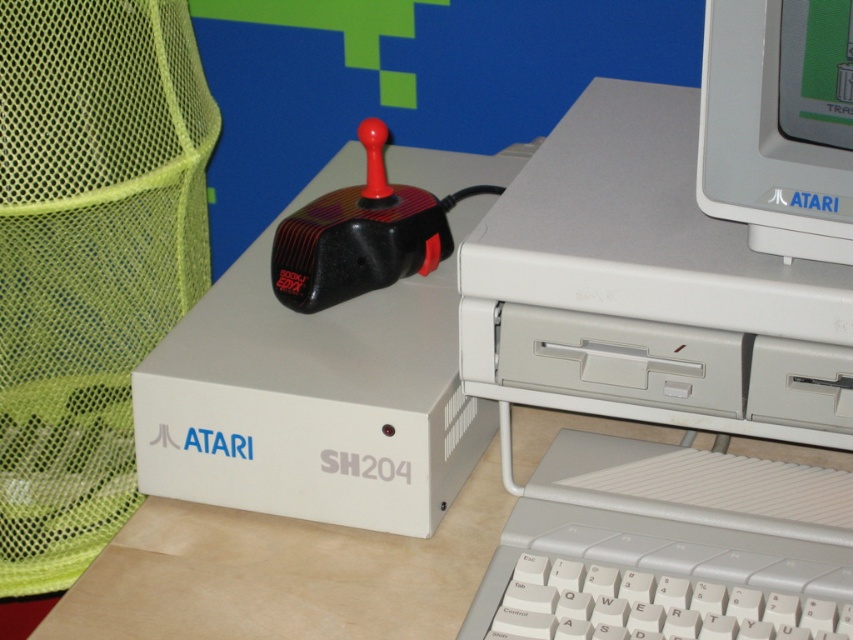
You are setting up a desk for a retro gaming setup. You have a white plastic computer at center and a matte plastic monitor at upper right. Which object should you place first to ensure proper height alignment?

The white plastic computer at center is taller than the matte plastic monitor at upper right, so you should place the matte plastic monitor at upper right first to ensure proper height alignment.

You are setting up a desk for a retro computing enthusiast. The desk has limited space. You have to place the white plastic computer at center and the matte plastic monitor at upper right. Which object requires more desk space?

The white plastic computer at center requires more desk space because it is bigger than the matte plastic monitor at upper right.